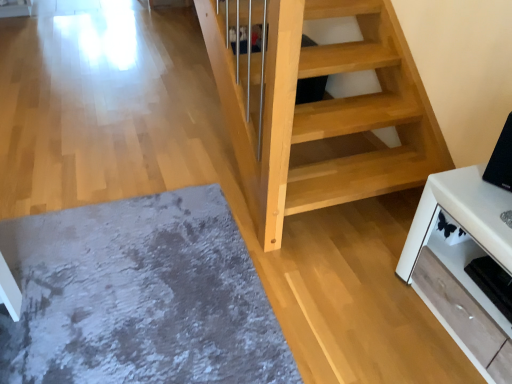
Question: Considering the positions of gray shaggy rug at lower left and white glossy tv stand at lower right in the image, is gray shaggy rug at lower left taller or shorter than white glossy tv stand at lower right?

Choices:
 (A) short
 (B) tall

Answer: (A)

Question: In terms of width, does gray shaggy rug at lower left look wider or thinner when compared to white glossy tv stand at lower right?

Choices:
 (A) wide
 (B) thin

Answer: (A)

Question: Considering the real-world distances, which object is farthest from the gray shaggy rug at lower left?

Choices:
 (A) black glossy tv at upper right
 (B) white glossy tv stand at lower right

Answer: (A)

Question: Which is farther from the black glossy tv at upper right?

Choices:
 (A) white glossy tv stand at lower right
 (B) gray shaggy rug at lower left

Answer: (B)